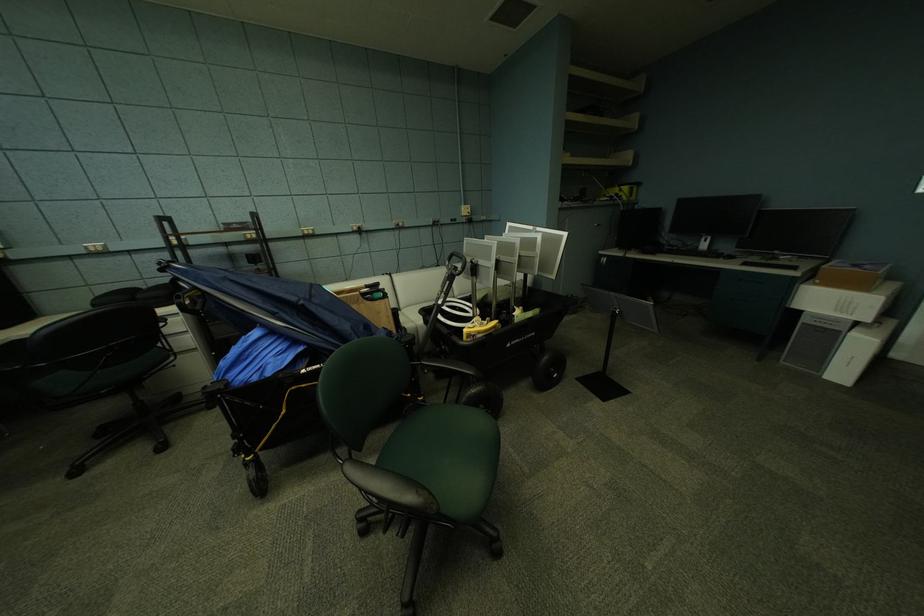
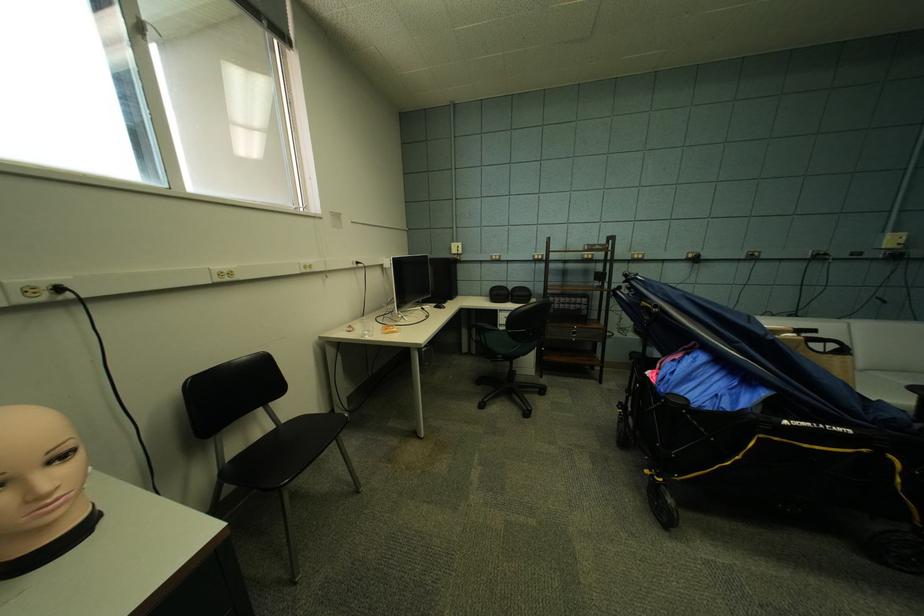
The point at (x=395, y=301) is marked in the first image. Where is the corresponding point in the second image?

(857, 358)